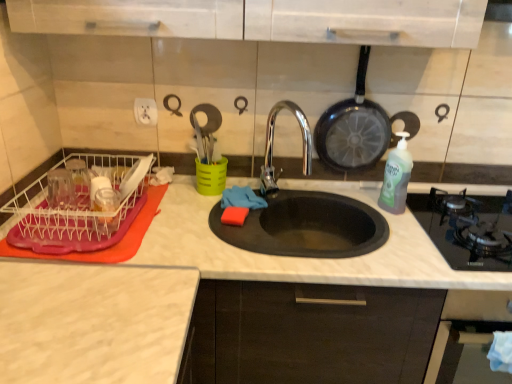
Where is `vacant area to the right of green translucent bottle at right`? vacant area to the right of green translucent bottle at right is located at coordinates (414, 213).